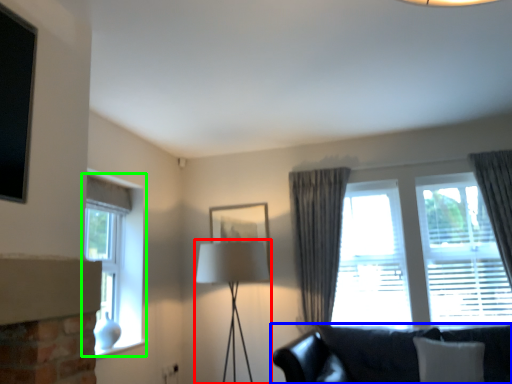
Question: Which object is the closest to the table lamp (highlighted by a red box)? Choose among these: studio couch (highlighted by a blue box) or window (highlighted by a green box).

Choices:
 (A) studio couch
 (B) window

Answer: (B)